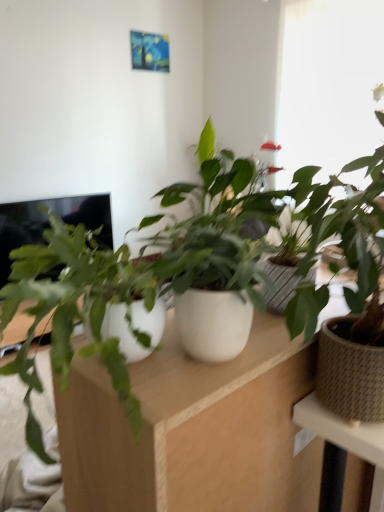
Question: Is white matte computer desk at center smaller than black glossy screen at left?

Choices:
 (A) yes
 (B) no

Answer: (A)

Question: Is black glossy screen at left located within white matte computer desk at center?

Choices:
 (A) yes
 (B) no

Answer: (B)

Question: Could you tell me if white matte computer desk at center is facing black glossy screen at left?

Choices:
 (A) yes
 (B) no

Answer: (B)

Question: Considering the relative positions of white matte computer desk at center and black glossy screen at left in the image provided, is white matte computer desk at center to the right of black glossy screen at left from the viewer's perspective?

Choices:
 (A) yes
 (B) no

Answer: (A)

Question: From the image's perspective, would you say white matte computer desk at center is shown under black glossy screen at left?

Choices:
 (A) no
 (B) yes

Answer: (B)

Question: From the image's perspective, is brown woven pot at right, the 2th houseplant in the left-to-right sequence, above or below white matte pot at center, which ranks as the 1th houseplant in left-to-right order?

Choices:
 (A) below
 (B) above

Answer: (A)

Question: Considering the positions of brown woven pot at right, the 2th houseplant in the left-to-right sequence, and white matte pot at center, which ranks as the 1th houseplant in left-to-right order, in the image, is brown woven pot at right, the 2th houseplant in the left-to-right sequence, wider or thinner than white matte pot at center, which ranks as the 1th houseplant in left-to-right order,?

Choices:
 (A) thin
 (B) wide

Answer: (A)

Question: Looking at the image, does brown woven pot at right, the 1th houseplant viewed from the right, seem bigger or smaller compared to white matte pot at center, which ranks as the 1th houseplant in left-to-right order?

Choices:
 (A) small
 (B) big

Answer: (B)

Question: Visually, is brown woven pot at right, the 1th houseplant viewed from the right, positioned to the left or to the right of white matte pot at center, positioned as the 2th houseplant in right-to-left order?

Choices:
 (A) right
 (B) left

Answer: (A)

Question: Is point (334, 346) positioned closer to the camera than point (34, 219)?

Choices:
 (A) farther
 (B) closer

Answer: (B)

Question: Would you say brown woven pot at right, the 2th houseplant in the left-to-right sequence, is inside or outside black glossy screen at left?

Choices:
 (A) inside
 (B) outside

Answer: (B)

Question: From the image's perspective, is brown woven pot at right, the 1th houseplant viewed from the right, above or below black glossy screen at left?

Choices:
 (A) below
 (B) above

Answer: (A)

Question: Relative to black glossy screen at left, is brown woven pot at right, the 1th houseplant viewed from the right, in front or behind?

Choices:
 (A) front
 (B) behind

Answer: (A)

Question: In terms of height, does black glossy screen at left look taller or shorter compared to brown woven pot at right, the 2th houseplant in the left-to-right sequence?

Choices:
 (A) tall
 (B) short

Answer: (A)

Question: Would you say black glossy screen at left is to the left or to the right of brown woven pot at right, the 1th houseplant viewed from the right, in the picture?

Choices:
 (A) left
 (B) right

Answer: (A)